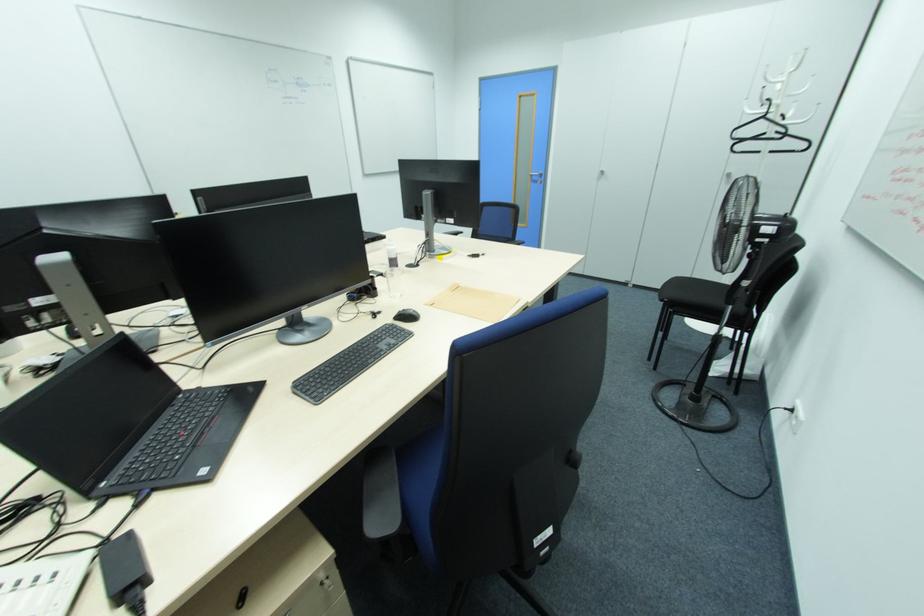
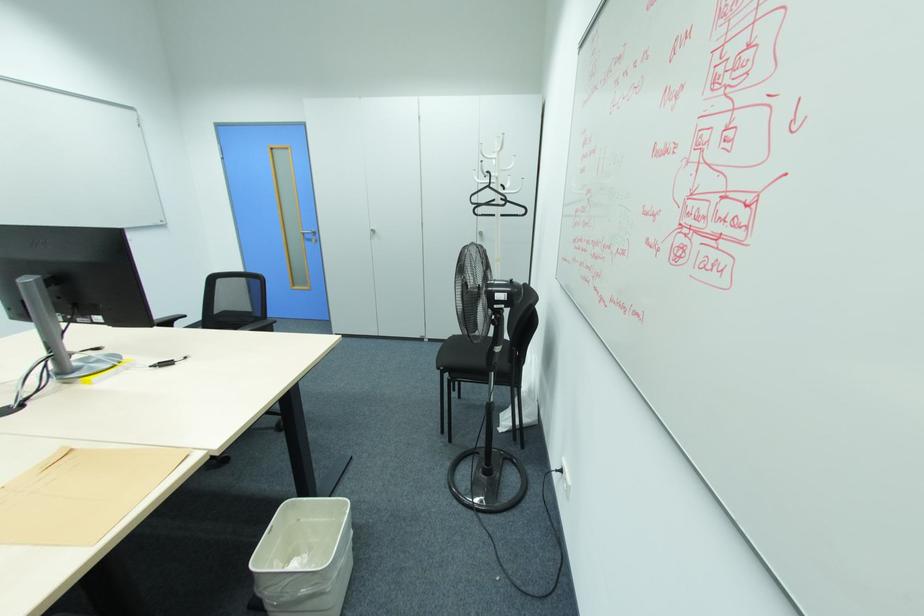
The point at (x=541, y=175) is marked in the first image. Where is the corresponding point in the second image?

(314, 233)